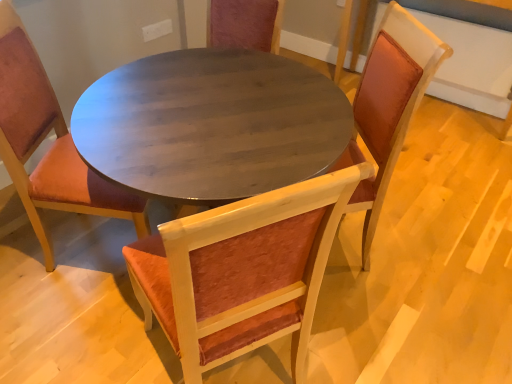
You are a GUI agent. You are given a task and a screenshot of the screen. Output one action in this format:
    pyautogui.click(x=<x>, y=<y>)
    Task: Click on the velvet orange chair at center, which ranks as the first chair in left-to-right order
    The width and height of the screenshot is (512, 384).
    Given the screenshot: What is the action you would take?
    pyautogui.click(x=52, y=146)

Measure the distance between point (280, 278) and camera.

Point (280, 278) and camera are 3.45 feet apart from each other.

What are the coordinates of `velvet orange chair at center, placed as the 3th chair when sorted from right to left` in the screenshot? It's located at (52, 146).

Is velvet orange chair at center, which ranks as the first chair in left-to-right order, bigger than velvet orange chair at center, which is the second chair from left to right?

No.

From the image's perspective, is velvet orange chair at center, placed as the 3th chair when sorted from right to left, on top of velvet orange chair at center, the 2th chair viewed from the right?

Yes.

Which is more to the right, velvet orange chair at center, which ranks as the first chair in left-to-right order, or velvet orange chair at center, which is the second chair from left to right?

Positioned to the right is velvet orange chair at center, which is the second chair from left to right.

From a real-world perspective, between velvet orange chair at center, placed as the 3th chair when sorted from right to left, and velvet orange chair at center, the 2th chair viewed from the right, who is vertically higher?

From a 3D spatial view, velvet orange chair at center, placed as the 3th chair when sorted from right to left, is above.

Is velvet orange chair at center, the 2th chair viewed from the right, facing towards velvet orange chair at center, which is counted as the 3th chair, starting from the left?

No, velvet orange chair at center, the 2th chair viewed from the right, does not turn towards velvet orange chair at center, which is counted as the 3th chair, starting from the left.

Looking at this image, is velvet orange chair at center, the 2th chair viewed from the right, surrounding velvet orange chair at center, which is counted as the 3th chair, starting from the left?

Definitely not — velvet orange chair at center, which is counted as the 3th chair, starting from the left, is not inside velvet orange chair at center, the 2th chair viewed from the right.

Looking at this image, from the image's perspective, is velvet orange chair at center, the 2th chair viewed from the right, beneath velvet orange chair at center, which is counted as the 3th chair, starting from the left?

Yes.

Is velvet orange chair at center, which is counted as the 3th chair, starting from the left, to the left or to the right of velvet orange chair at center, which is the second chair from left to right, in the image?

Based on their positions, velvet orange chair at center, which is counted as the 3th chair, starting from the left, is located to the right of velvet orange chair at center, which is the second chair from left to right.

Who is smaller, velvet orange chair at center, which is counted as the 3th chair, starting from the left, or velvet orange chair at center, the 2th chair viewed from the right?

velvet orange chair at center, the 2th chair viewed from the right, is smaller.

Could velvet orange chair at center, which is the second chair from left to right, be considered to be inside velvet orange chair at center, which is counted as the 3th chair, starting from the left?

Definitely not — velvet orange chair at center, which is the second chair from left to right, is not inside velvet orange chair at center, which is counted as the 3th chair, starting from the left.

From the image's perspective, who appears lower, velvet orange chair at center, which is the second chair from left to right, or velvet orange chair at center, placed as the 3th chair when sorted from right to left?

From the image's view, velvet orange chair at center, which is the second chair from left to right, is below.

Is velvet orange chair at center, the 2th chair viewed from the right, facing away from velvet orange chair at center, which ranks as the first chair in left-to-right order?

No, velvet orange chair at center, which ranks as the first chair in left-to-right order, is not at the back of velvet orange chair at center, the 2th chair viewed from the right.

In the scene shown: Which is in front, velvet orange chair at center, the 2th chair viewed from the right, or velvet orange chair at center, which ranks as the first chair in left-to-right order?

velvet orange chair at center, the 2th chair viewed from the right.

Who is smaller, velvet orange chair at center, which is the second chair from left to right, or velvet orange chair at center, which ranks as the first chair in left-to-right order?

velvet orange chair at center, which ranks as the first chair in left-to-right order.

Does point (406, 24) appear closer or farther from the camera than point (7, 19)?

Point (406, 24) is positioned closer to the camera compared to point (7, 19).

How different are the orientations of velvet orange chair at center, which ranks as the first chair in right-to-left order, and velvet orange chair at center, which ranks as the first chair in left-to-right order, in degrees?

166 degrees separate the facing orientations of velvet orange chair at center, which ranks as the first chair in right-to-left order, and velvet orange chair at center, which ranks as the first chair in left-to-right order.

In the scene shown: From the image's perspective, which is above, velvet orange chair at center, which is counted as the 3th chair, starting from the left, or velvet orange chair at center, which ranks as the first chair in left-to-right order?

velvet orange chair at center, which ranks as the first chair in left-to-right order, is shown above in the image.

Is velvet orange chair at center, which ranks as the first chair in right-to-left order, to the left or to the right of velvet orange chair at center, which ranks as the first chair in left-to-right order, in the image?

velvet orange chair at center, which ranks as the first chair in right-to-left order, is to the right of velvet orange chair at center, which ranks as the first chair in left-to-right order.

Could you tell me if velvet orange chair at center, which ranks as the first chair in left-to-right order, is turned towards velvet orange chair at center, which ranks as the first chair in right-to-left order?

Yes.

Considering the sizes of velvet orange chair at center, placed as the 3th chair when sorted from right to left, and velvet orange chair at center, which is counted as the 3th chair, starting from the left, in the image, is velvet orange chair at center, placed as the 3th chair when sorted from right to left, wider or thinner than velvet orange chair at center, which is counted as the 3th chair, starting from the left,?

In the image, velvet orange chair at center, placed as the 3th chair when sorted from right to left, appears to be more narrow than velvet orange chair at center, which is counted as the 3th chair, starting from the left.

Looking at this image, does velvet orange chair at center, placed as the 3th chair when sorted from right to left, have a smaller size compared to velvet orange chair at center, which ranks as the first chair in right-to-left order?

Yes.

At what (x,y) coordinates should I click in order to perform the action: click on chair that is the 2nd one when counting downward from the velvet orange chair at center, placed as the 3th chair when sorted from right to left (from the image's perspective). Please return your answer as a coordinate pair (x, y). This screenshot has width=512, height=384. Looking at the image, I should click on (242, 272).

Locate an element on the screen. the 2nd chair positioned below the velvet orange chair at center, which is counted as the 3th chair, starting from the left (from a real-world perspective) is located at coordinates (242, 272).

Considering their positions, is velvet orange chair at center, which is the second chair from left to right, positioned further to velvet orange chair at center, placed as the 3th chair when sorted from right to left, than velvet orange chair at center, which is counted as the 3th chair, starting from the left?

velvet orange chair at center, which is counted as the 3th chair, starting from the left, is further to velvet orange chair at center, placed as the 3th chair when sorted from right to left.

Considering their positions, is velvet orange chair at center, which ranks as the first chair in left-to-right order, positioned further to velvet orange chair at center, which is the second chair from left to right, than velvet orange chair at center, which is counted as the 3th chair, starting from the left?

Based on the image, velvet orange chair at center, which is counted as the 3th chair, starting from the left, appears to be further to velvet orange chair at center, which is the second chair from left to right.

When comparing their distances from velvet orange chair at center, which is counted as the 3th chair, starting from the left, does velvet orange chair at center, placed as the 3th chair when sorted from right to left, or velvet orange chair at center, the 2th chair viewed from the right, seem closer?

velvet orange chair at center, the 2th chair viewed from the right, lies closer to velvet orange chair at center, which is counted as the 3th chair, starting from the left, than the other object.

From the image, which object appears to be farther from velvet orange chair at center, which ranks as the first chair in right-to-left order, velvet orange chair at center, which is the second chair from left to right, or velvet orange chair at center, placed as the 3th chair when sorted from right to left?

velvet orange chair at center, placed as the 3th chair when sorted from right to left, is positioned further to the anchor velvet orange chair at center, which ranks as the first chair in right-to-left order.

From the image, which object appears to be farther from velvet orange chair at center, placed as the 3th chair when sorted from right to left, velvet orange chair at center, which ranks as the first chair in right-to-left order, or velvet orange chair at center, the 2th chair viewed from the right?

velvet orange chair at center, which ranks as the first chair in right-to-left order, is further to velvet orange chair at center, placed as the 3th chair when sorted from right to left.

Estimate the real-world distances between objects in this image. Which object is closer to velvet orange chair at center, which is the second chair from left to right, velvet orange chair at center, which ranks as the first chair in right-to-left order, or velvet orange chair at center, which ranks as the first chair in left-to-right order?

Based on the image, velvet orange chair at center, which ranks as the first chair in left-to-right order, appears to be nearer to velvet orange chair at center, which is the second chair from left to right.

Locate an element on the screen. This screenshot has height=384, width=512. chair located between velvet orange chair at center, which ranks as the first chair in left-to-right order, and velvet orange chair at center, which ranks as the first chair in right-to-left order, in the left-right direction is located at coordinates (242, 272).